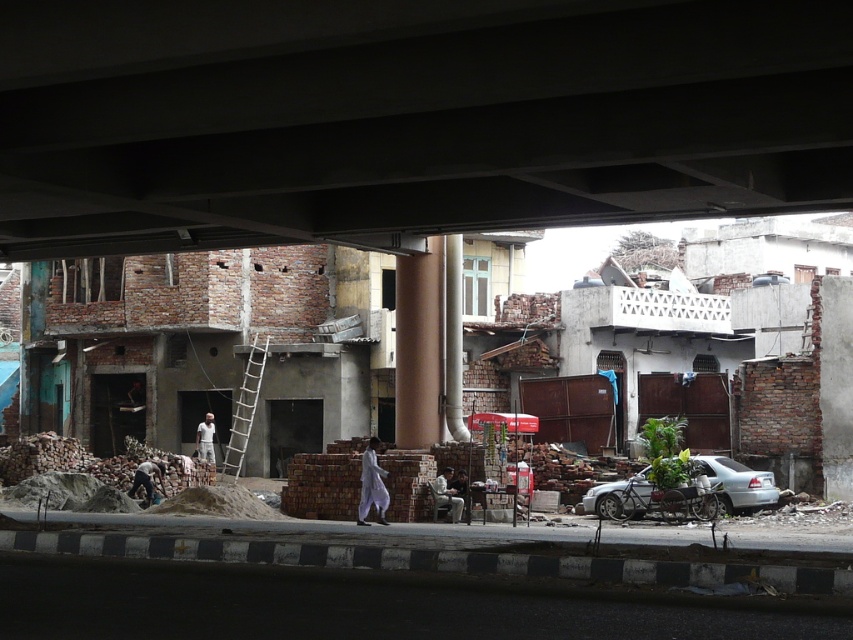
Question: Which point is closer to the camera?

Choices:
 (A) (230, 476)
 (B) (445, 497)
 (C) (212, 419)

Answer: (B)

Question: Among these points, which one is nearest to the camera?

Choices:
 (A) (621, 490)
 (B) (201, 435)

Answer: (A)

Question: Can you confirm if silver metallic car at lower right is thinner than white cotton shirt at center?

Choices:
 (A) yes
 (B) no

Answer: (B)

Question: Can you confirm if silver metallic car at lower right is positioned above white cotton shirt at center?

Choices:
 (A) yes
 (B) no

Answer: (A)

Question: Considering the real-world distances, which object is closest to the dark gray concrete overpass at upper center?

Choices:
 (A) silver metallic car at lower right
 (B) light brown fabric shirt at center

Answer: (B)

Question: Does white wooden ladder at center have a greater width compared to light brown fabric shirt at center?

Choices:
 (A) yes
 (B) no

Answer: (A)